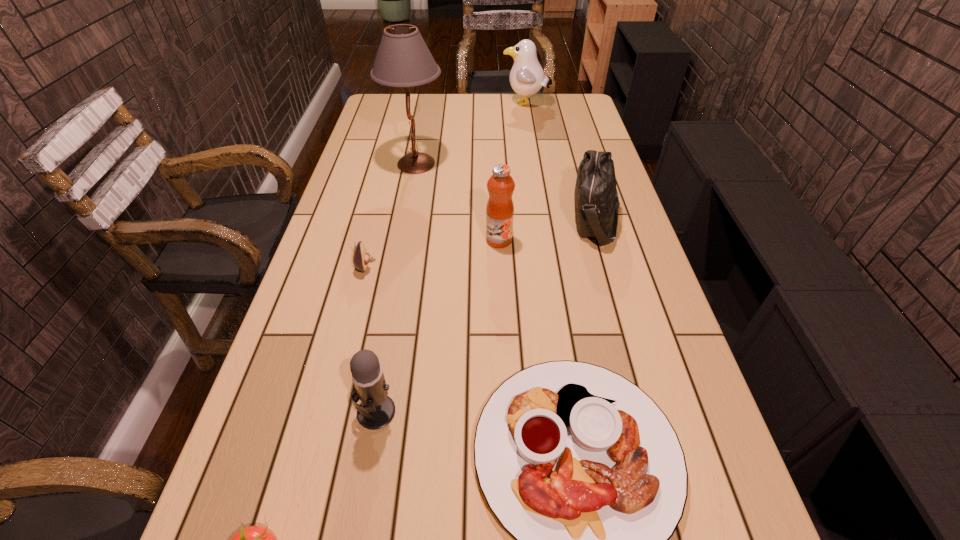
This screenshot has height=540, width=960. What are the coordinates of `free space located 0.210m on the beak of the gull` in the screenshot? It's located at (452, 105).

Locate an element on the screen. free point located 0.400m on the beak of the gull is located at coordinates (408, 105).

In order to click on vacant space situated on the front label of the fruit juice in this screenshot , I will do `click(503, 338)`.

This screenshot has height=540, width=960. In order to click on free location located at the front padded panel of the shoulder bag in this screenshot , I will do `click(453, 219)`.

Where is `free space located at the front padded panel of the shoulder bag`? free space located at the front padded panel of the shoulder bag is located at coordinates (532, 219).

Where is `vacant space located at the front padded panel of the shoulder bag`? The width and height of the screenshot is (960, 540). vacant space located at the front padded panel of the shoulder bag is located at coordinates (506, 219).

The image size is (960, 540). Find the location of `blank space located on the front of the microphone`. blank space located on the front of the microphone is located at coordinates (362, 489).

At what (x,y) coordinates should I click in order to perform the action: click on vacant space located on the seed side of the fourth nearest object. Please return your answer as a coordinate pair (x, y). This screenshot has width=960, height=540. Looking at the image, I should click on (451, 265).

Where is `object present at the far edge`? This screenshot has height=540, width=960. object present at the far edge is located at coordinates (527, 77).

This screenshot has width=960, height=540. I want to click on table lamp that is at the left edge, so tap(403, 59).